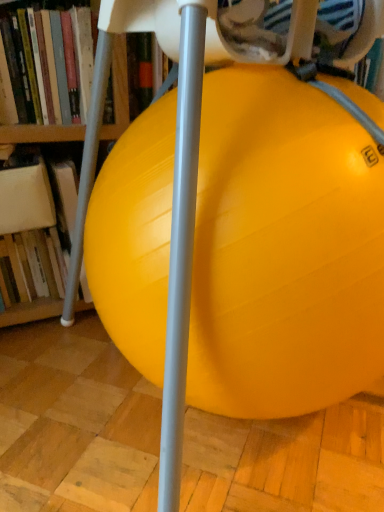
Question: Does hardcover book at left, which is the first book from top to bottom, contain hardcover book at left, positioned as the 2th book in top-to-bottom order?

Choices:
 (A) yes
 (B) no

Answer: (B)

Question: From a real-world perspective, is hardcover book at left, which ranks as the 2th book in bottom-to-top order, below hardcover book at left, positioned as the 2th book in top-to-bottom order?

Choices:
 (A) no
 (B) yes

Answer: (A)

Question: From the image's perspective, is hardcover book at left, which ranks as the 2th book in bottom-to-top order, located above hardcover book at left, positioned as the 2th book in top-to-bottom order?

Choices:
 (A) yes
 (B) no

Answer: (A)

Question: Is hardcover book at left, which is the first book from top to bottom, touching hardcover book at left, positioned as the 1th book in bottom-to-top order?

Choices:
 (A) no
 (B) yes

Answer: (A)

Question: Is hardcover book at left, which is the first book from top to bottom, further to the viewer compared to hardcover book at left, positioned as the 2th book in top-to-bottom order?

Choices:
 (A) no
 (B) yes

Answer: (A)

Question: Is hardcover book at left, which is the first book from top to bottom, closer to the viewer compared to hardcover book at left, positioned as the 1th book in bottom-to-top order?

Choices:
 (A) no
 (B) yes

Answer: (B)

Question: From a real-world perspective, is yellow rubber ball at center physically below hardcover book at left, which is the first book from top to bottom?

Choices:
 (A) no
 (B) yes

Answer: (B)

Question: Does yellow rubber ball at center have a greater width compared to hardcover book at left, which ranks as the 2th book in bottom-to-top order?

Choices:
 (A) no
 (B) yes

Answer: (B)

Question: Is yellow rubber ball at center further to camera compared to hardcover book at left, which is the first book from top to bottom?

Choices:
 (A) yes
 (B) no

Answer: (B)

Question: Are yellow rubber ball at center and hardcover book at left, which is the first book from top to bottom, located far from each other?

Choices:
 (A) yes
 (B) no

Answer: (B)

Question: Are yellow rubber ball at center and hardcover book at left, which ranks as the 2th book in bottom-to-top order, making contact?

Choices:
 (A) no
 (B) yes

Answer: (A)

Question: Is yellow rubber ball at center positioned in front of hardcover book at left, which ranks as the 2th book in bottom-to-top order?

Choices:
 (A) no
 (B) yes

Answer: (B)